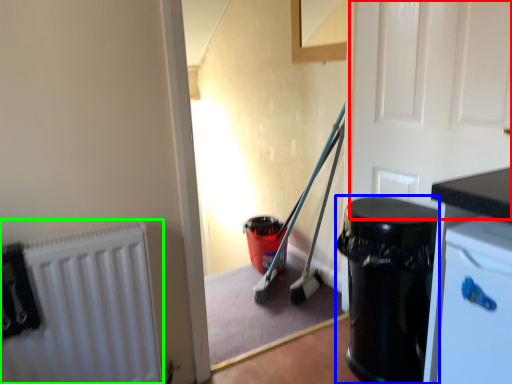
Question: Estimate the real-world distances between objects in this image. Which object is farther from door (highlighted by a red box), garbage (highlighted by a blue box) or radiator (highlighted by a green box)?

Choices:
 (A) garbage
 (B) radiator

Answer: (B)